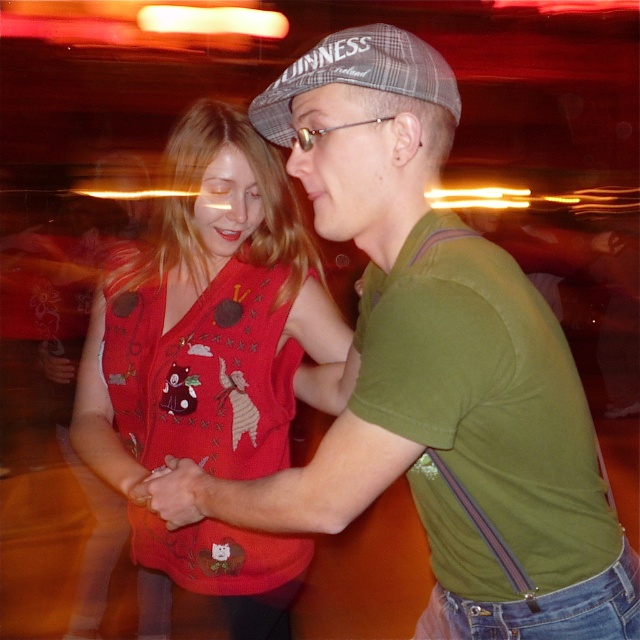
You are at a party and want to hang a small decoration between the matte red sweater vest at center and the plaid fabric baseball cap at upper center. Since the sweater vest is taller, will the decoration need to be placed higher or lower to be centered between them?

The decoration should be placed higher since the matte red sweater vest at center is taller than the plaid fabric baseball cap at upper center, so the midpoint between them would be closer to the cap.

You are at a social event and want to take a photo of the point at coordinates [182,218]. The camera you have can focus on objects within 5 feet. Will the point be in focus?

The point at coordinates [182,218] is 5.06 feet away from the viewer, so it is slightly out of the camera focus range of 5 feet. The point will not be in focus.

You are at a party and want to find the matte red sweater vest at center. According to the coordinates provided, where should you look?

The matte red sweater vest at center is located at point 0.566 on the x axis and 0.328 on the y axis.